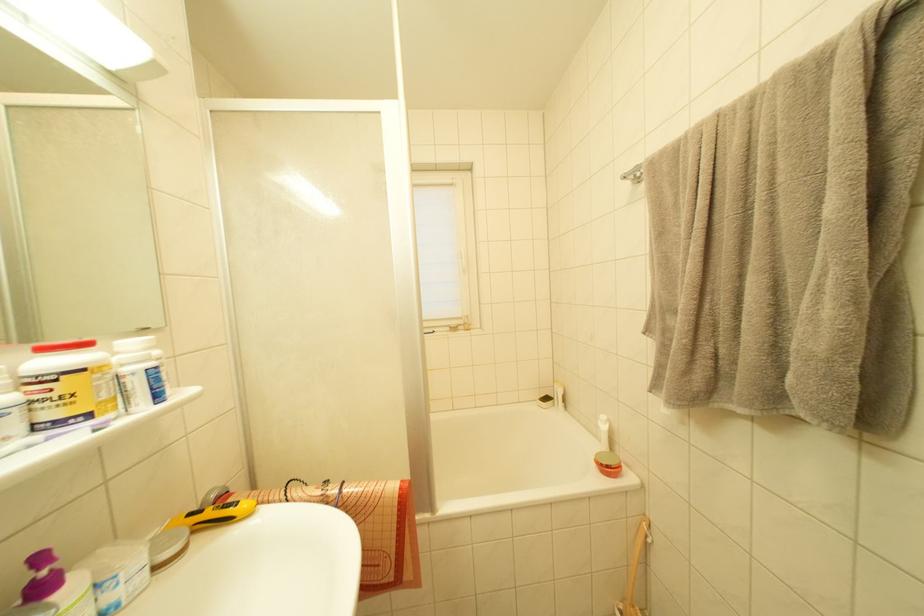
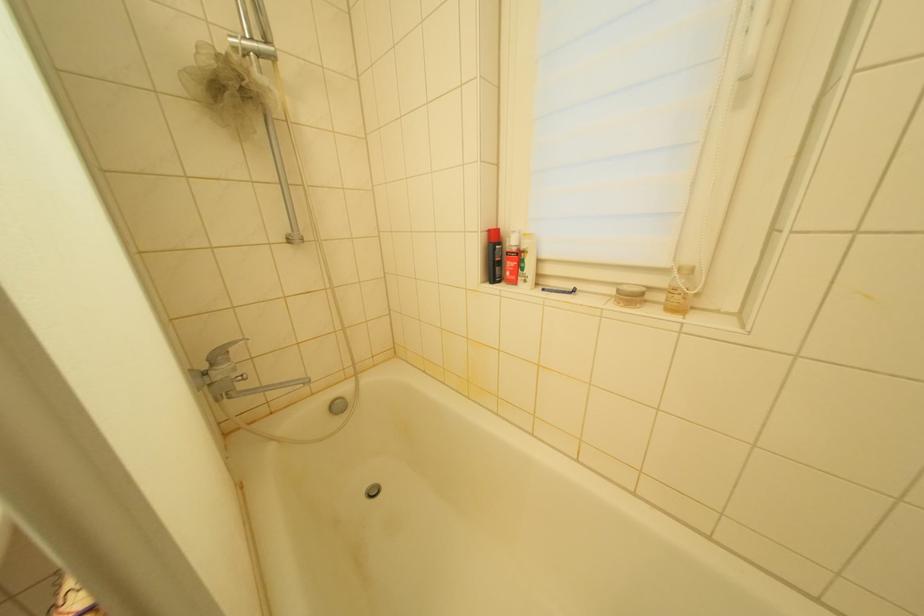
Where in the second image is the point corresponding to pixel 455 331 from the first image?

(623, 294)